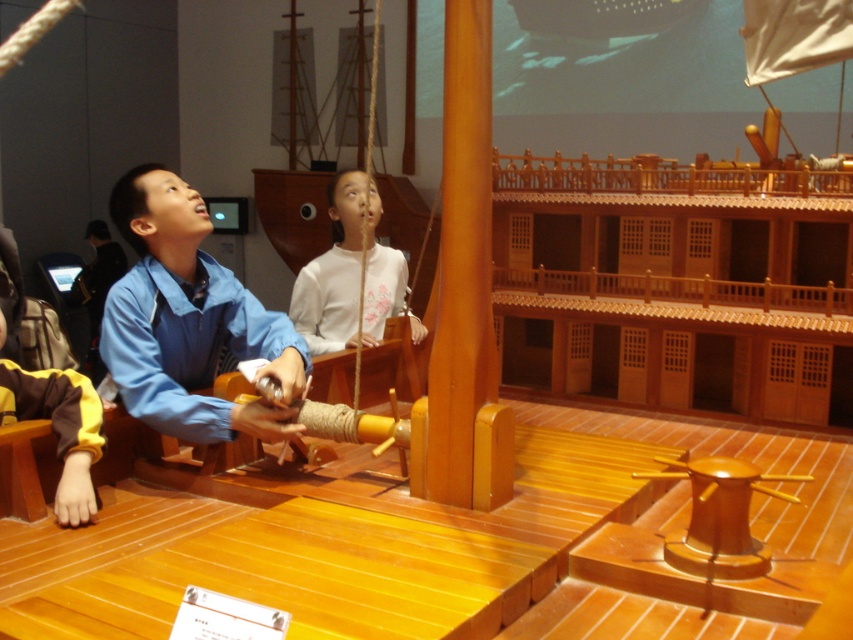
Question: Estimate the real-world distances between objects in this image. Which object is farther from the white matte shirt at center?

Choices:
 (A) yellow fabric sleeve at lower left
 (B) blue fabric shirt at center

Answer: (A)

Question: Observing the image, what is the correct spatial positioning of blue fabric shirt at center in reference to white matte shirt at center?

Choices:
 (A) left
 (B) right

Answer: (A)

Question: Which of the following is the closest to the observer?

Choices:
 (A) (70, 456)
 (B) (376, 337)

Answer: (A)

Question: Considering the relative positions of white matte shirt at center and yellow fabric sleeve at lower left in the image provided, where is white matte shirt at center located with respect to yellow fabric sleeve at lower left?

Choices:
 (A) left
 (B) right

Answer: (B)

Question: Which object is the closest to the yellow fabric sleeve at lower left?

Choices:
 (A) white matte shirt at center
 (B) blue fabric shirt at center

Answer: (B)

Question: Can you confirm if blue fabric shirt at center is positioned to the left of yellow fabric sleeve at lower left?

Choices:
 (A) yes
 (B) no

Answer: (B)